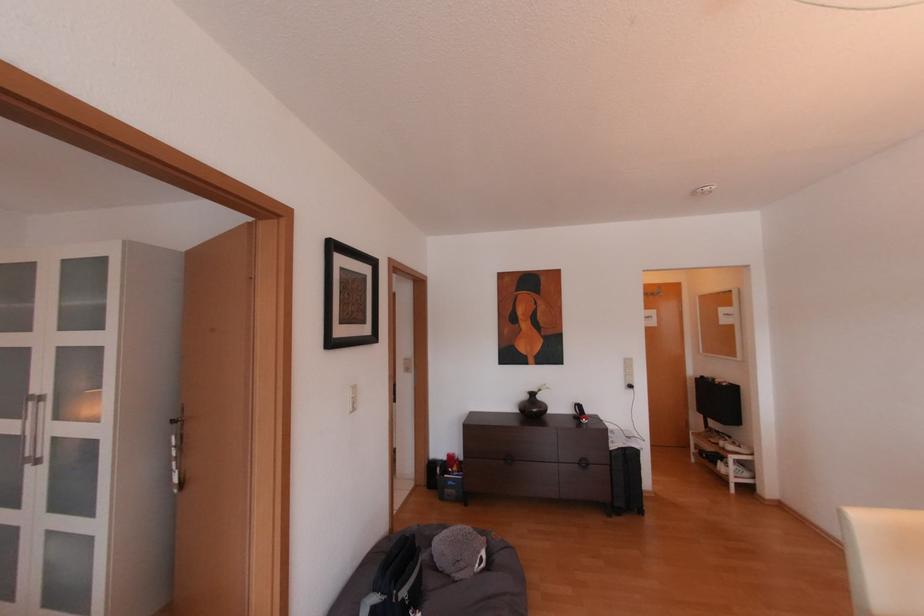
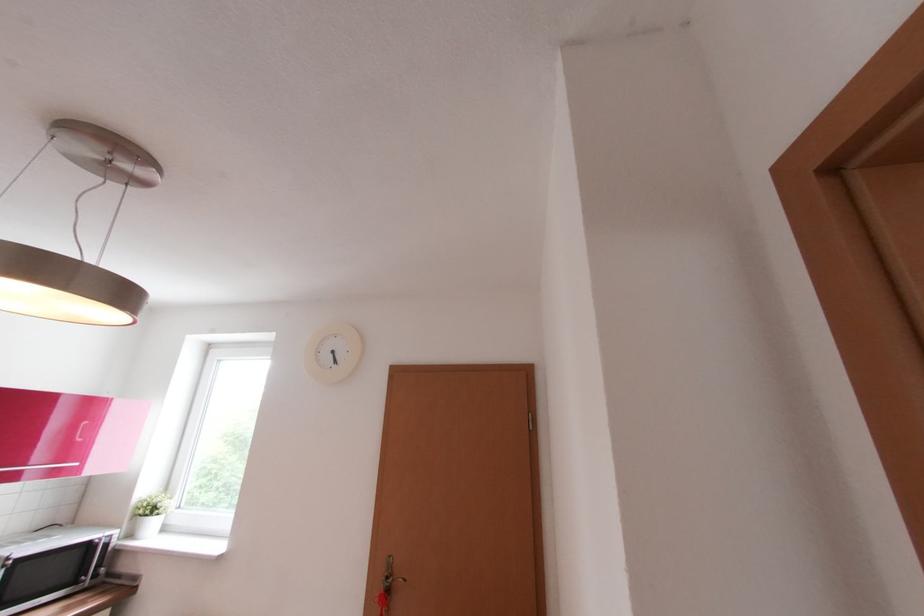
Question: Which direction would the cameraman need to move to produce the second image? Reply with the corresponding letter.

Choices:
 (A) Left
 (B) Right
 (C) Forward
 (D) Backward

Answer: (C)